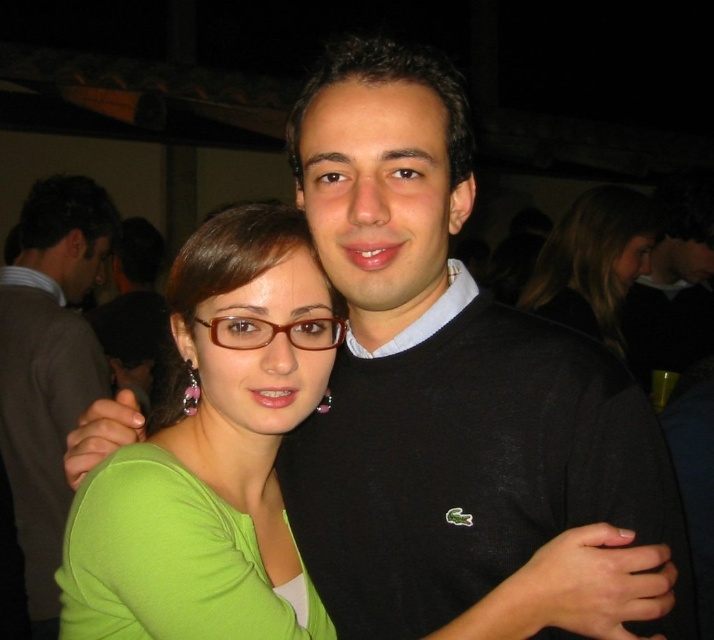
Question: Estimate the real-world distances between objects in this image. Which object is closer to the matte brown hair at upper right?

Choices:
 (A) green matte shirt at center
 (B) brown matte glasses at center
 (C) black matte sweater at center
 (D) matte black sweater at center

Answer: (C)

Question: Is green matte shirt at center bigger than matte black sweater at center?

Choices:
 (A) no
 (B) yes

Answer: (A)

Question: Is the position of green matte shirt at center more distant than that of brown matte glasses at center?

Choices:
 (A) no
 (B) yes

Answer: (A)

Question: Which point is farther to the camera?

Choices:
 (A) (26, 605)
 (B) (620, 198)
 (C) (119, 336)

Answer: (C)

Question: Is black sweater at center further to the viewer compared to black matte sweater at center?

Choices:
 (A) no
 (B) yes

Answer: (A)

Question: Which object is farther from the camera taking this photo?

Choices:
 (A) brown matte glasses at center
 (B) black sweater at center
 (C) green matte shirt at center
 (D) matte black sweater at center

Answer: (D)